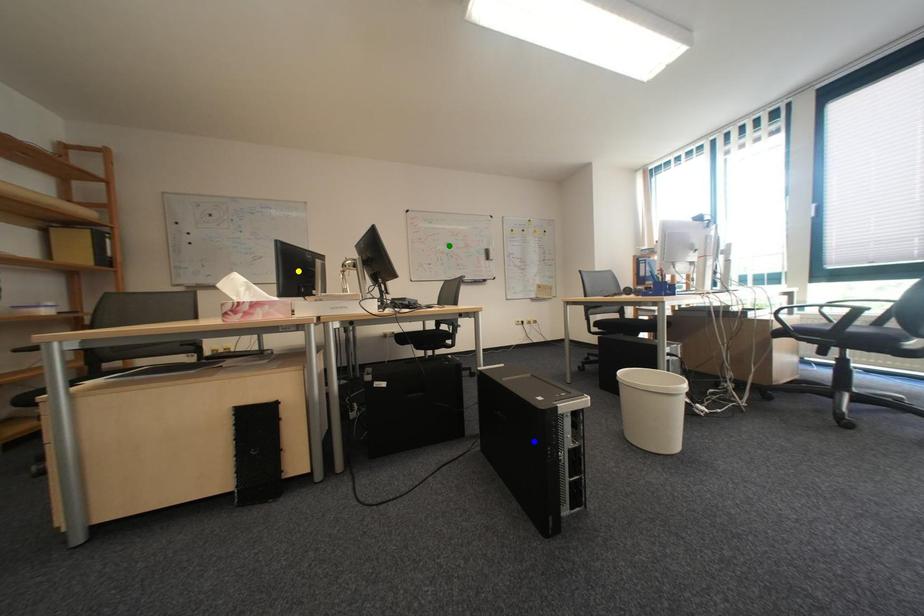
Order these from farthest to nearest:
1. yellow point
2. green point
3. blue point

1. green point
2. yellow point
3. blue point